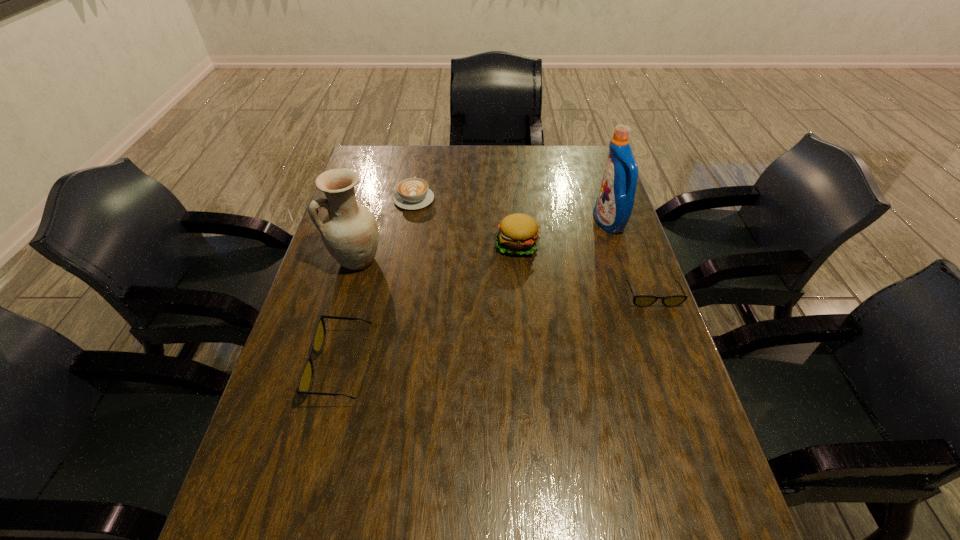
The width and height of the screenshot is (960, 540). I want to click on the nearest object, so point(305,381).

Where is `the left sunglasses`? The image size is (960, 540). the left sunglasses is located at coordinates (305, 381).

Find the location of a particular element. the right sunglasses is located at coordinates (639, 300).

This screenshot has height=540, width=960. Identify the location of the farther sunglasses. (639, 300).

Identify the location of cappuccino. This screenshot has height=540, width=960. point(413,193).

Locate an element on the screen. the third object from right to left is located at coordinates (518, 234).

Locate an element on the screen. hamburger is located at coordinates (518, 234).

Identify the location of detergent. (614, 204).

Find the location of a particular element. pottery is located at coordinates (350, 233).

Where is `free region located 0.230m on the side of the cappuccino with the handle`? Image resolution: width=960 pixels, height=540 pixels. free region located 0.230m on the side of the cappuccino with the handle is located at coordinates (422, 152).